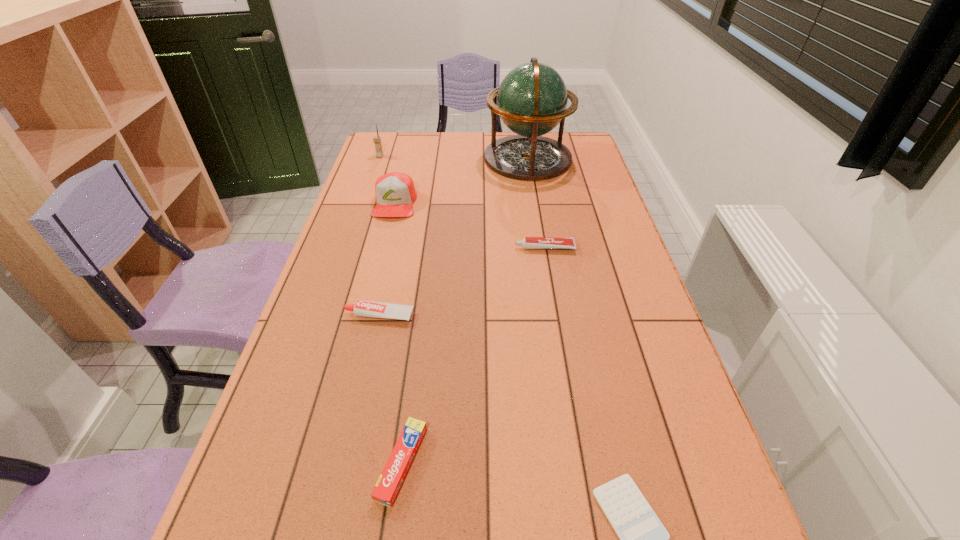
Where is `globe`? The height and width of the screenshot is (540, 960). globe is located at coordinates (532, 99).

This screenshot has height=540, width=960. In order to click on cellular telephone in this screenshot , I will do `click(377, 140)`.

Identify the location of the sixth shortest object. (377, 140).

Where is `baseball cap`? The width and height of the screenshot is (960, 540). baseball cap is located at coordinates (395, 193).

Where is `the fifth nearest object`? The height and width of the screenshot is (540, 960). the fifth nearest object is located at coordinates (395, 193).

Where is `the second farthest toothpaste`? The height and width of the screenshot is (540, 960). the second farthest toothpaste is located at coordinates (362, 308).

I want to click on the fourth farthest object, so click(x=528, y=242).

The height and width of the screenshot is (540, 960). Identify the location of the farthest toothpaste. (528, 242).

Where is `the nearest toothpaste`? the nearest toothpaste is located at coordinates (397, 466).

Find the location of a particular element. the shortest toothpaste is located at coordinates (397, 466).